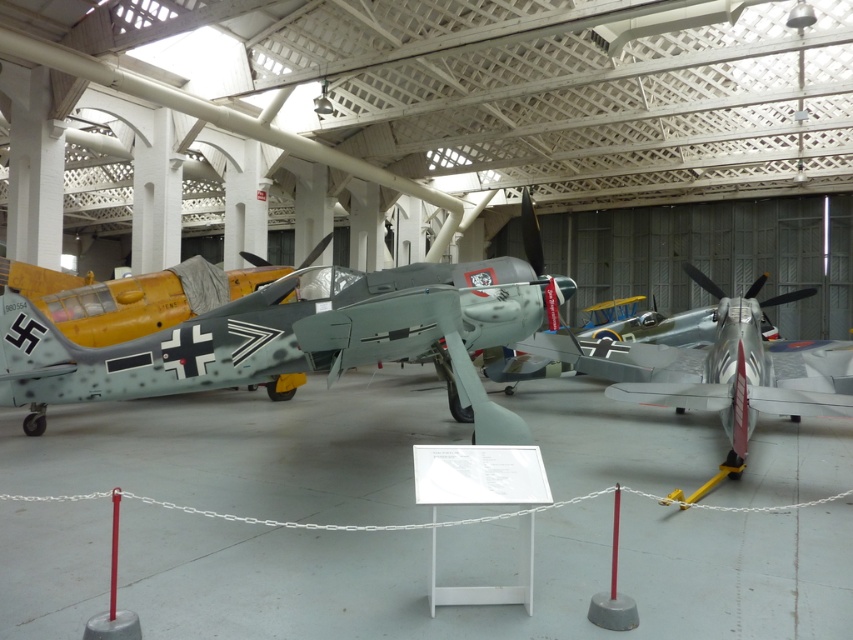
You are a tour guide leading a group through the museum. You need to move a 2.5 meter wide cart between the silver metallic airplane at center and the camouflage paint airplane at left. Can the cart fit through the space between them?

The silver metallic airplane at center and camouflage paint airplane at left are 7.50 meters apart from each other. Since the cart is only 2.5 meters wide, there is sufficient space for the cart to pass through the 7.50 meter gap between the two aircraft.

You are standing in the museum looking at the vintage military aircraft. There are two points marked in the image. Which point, point (x=560, y=346) or point (x=213, y=307), is closer to you?

Point (x=560, y=346) is closer to the viewer than point (x=213, y=307).